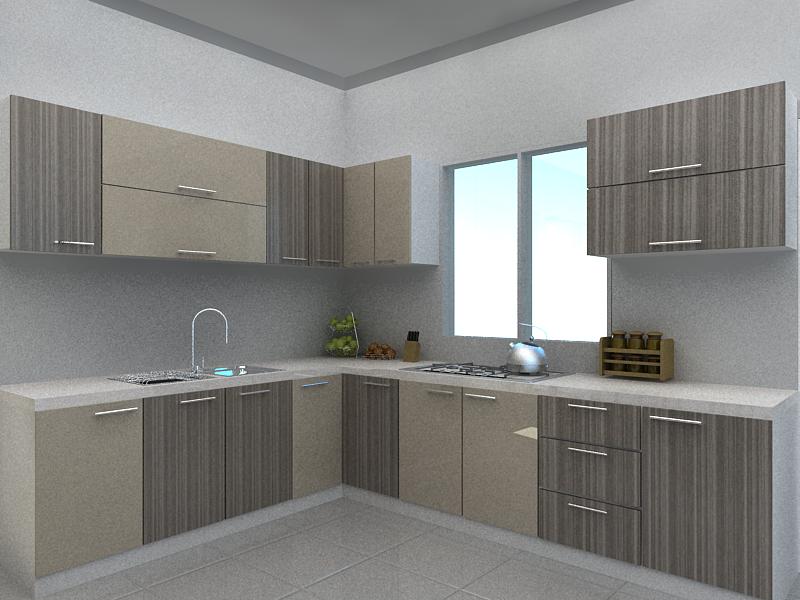
I want to click on window, so tap(568, 319).